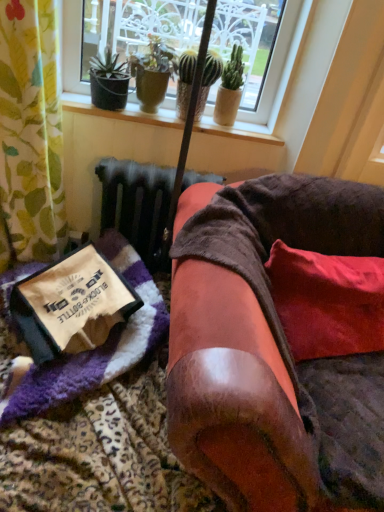
Describe the element at coordinates (185, 82) in the screenshot. This screenshot has height=512, width=384. I see `green textured cactus at upper center, which is the second houseplant in right-to-left order` at that location.

This screenshot has width=384, height=512. I want to click on red velvet pillow at lower right, so tap(327, 301).

This screenshot has height=512, width=384. What are the coordinates of `green matte cactus at upper center, which is the 1th houseplant from right to left` in the screenshot? It's located at (230, 89).

Describe the element at coordinates (121, 112) in the screenshot. I see `wooden at upper center` at that location.

Where is `green textured pot at upper center, the third houseplant in the right-to-left sequence`? The width and height of the screenshot is (384, 512). green textured pot at upper center, the third houseplant in the right-to-left sequence is located at coordinates (152, 73).

You are a GUI agent. You are given a task and a screenshot of the screen. Output one action in this format:
    pyautogui.click(x=<x>, y=<y>)
    Task: Click on the green textured cactus at upper center, which is the second houseplant in right-to-left order
    The height and width of the screenshot is (512, 384).
    Given the screenshot: What is the action you would take?
    pyautogui.click(x=185, y=82)

Is green textured pot at upper center, placed as the first houseplant when sorted from left to right, inside purple fuzzy blanket at lower left?

No, green textured pot at upper center, placed as the first houseplant when sorted from left to right, is not inside purple fuzzy blanket at lower left.

Is purple fuzzy blanket at lower left in front of or behind green textured pot at upper center, the third houseplant in the right-to-left sequence, in the image?

purple fuzzy blanket at lower left is in front of green textured pot at upper center, the third houseplant in the right-to-left sequence.

Are purple fuzzy blanket at lower left and green textured pot at upper center, placed as the first houseplant when sorted from left to right, making contact?

No, purple fuzzy blanket at lower left is not with green textured pot at upper center, placed as the first houseplant when sorted from left to right.

Consider the image. From a real-world perspective, is purple fuzzy blanket at lower left physically located above or below green textured pot at upper center, the third houseplant in the right-to-left sequence?

Clearly, from a real-world perspective, purple fuzzy blanket at lower left is below green textured pot at upper center, the third houseplant in the right-to-left sequence.

Considering the relative sizes of green textured pot at upper center, the third houseplant in the right-to-left sequence, and green matte cactus at upper center, which is the 1th houseplant from right to left, in the image provided, is green textured pot at upper center, the third houseplant in the right-to-left sequence, thinner than green matte cactus at upper center, which is the 1th houseplant from right to left,?

Incorrect, the width of green textured pot at upper center, the third houseplant in the right-to-left sequence, is not less than that of green matte cactus at upper center, which is the 1th houseplant from right to left.

Would you say green textured pot at upper center, placed as the first houseplant when sorted from left to right, is outside green matte cactus at upper center, which is the third houseplant from left to right?

Yes, green textured pot at upper center, placed as the first houseplant when sorted from left to right, is not within green matte cactus at upper center, which is the third houseplant from left to right.

Is green textured pot at upper center, the third houseplant in the right-to-left sequence, taller than green matte cactus at upper center, which is the third houseplant from left to right?

No, green textured pot at upper center, the third houseplant in the right-to-left sequence, is not taller than green matte cactus at upper center, which is the third houseplant from left to right.

From the image's perspective, is green textured pot at upper center, placed as the first houseplant when sorted from left to right, beneath green matte cactus at upper center, which is the 1th houseplant from right to left?

Actually, green textured pot at upper center, placed as the first houseplant when sorted from left to right, appears above green matte cactus at upper center, which is the 1th houseplant from right to left, in the image.

From the image's perspective, is purple fuzzy blanket at lower left located above or below wooden at upper center?

Clearly, from the image's perspective, purple fuzzy blanket at lower left is below wooden at upper center.

Is purple fuzzy blanket at lower left positioned before wooden at upper center?

Yes, purple fuzzy blanket at lower left is in front of wooden at upper center.

Is point (94, 381) more distant than point (140, 115)?

That is False.

Considering the relative sizes of purple fuzzy blanket at lower left and wooden at upper center in the image provided, is purple fuzzy blanket at lower left bigger than wooden at upper center?

Yes, purple fuzzy blanket at lower left is bigger than wooden at upper center.

Is green textured cactus at upper center, which is the second houseplant in right-to-left order, positioned in front of purple fuzzy blanket at lower left?

No, green textured cactus at upper center, which is the second houseplant in right-to-left order, is further to the viewer.

Considering the points (182, 76) and (61, 360), which point is behind, point (182, 76) or point (61, 360)?

Point (182, 76)

Can purple fuzzy blanket at lower left be found inside green textured cactus at upper center, the second houseplant in the left-to-right sequence?

Actually, purple fuzzy blanket at lower left is outside green textured cactus at upper center, the second houseplant in the left-to-right sequence.

Which object is wider, green textured cactus at upper center, which is the second houseplant in right-to-left order, or purple fuzzy blanket at lower left?

purple fuzzy blanket at lower left.

Are red velvet pillow at lower right and velvet brown armchair at center located far from each other?

red velvet pillow at lower right is near velvet brown armchair at center, not far away.

From a real-world perspective, is red velvet pillow at lower right beneath velvet brown armchair at center?

Incorrect, from a real-world perspective, red velvet pillow at lower right is higher than velvet brown armchair at center.

This screenshot has width=384, height=512. Identify the location of pillow behind the velvet brown armchair at center. (327, 301).

Visually, is green textured pot at upper center, placed as the first houseplant when sorted from left to right, positioned to the left or to the right of wooden at upper center?

Based on their positions, green textured pot at upper center, placed as the first houseplant when sorted from left to right, is located to the left of wooden at upper center.

From a real-world perspective, relative to wooden at upper center, is green textured pot at upper center, the third houseplant in the right-to-left sequence, vertically above or below?

green textured pot at upper center, the third houseplant in the right-to-left sequence, is situated higher than wooden at upper center in the real world.

Based on the photo, is green textured pot at upper center, the third houseplant in the right-to-left sequence, not within wooden at upper center?

Indeed, green textured pot at upper center, the third houseplant in the right-to-left sequence, is completely outside wooden at upper center.

Considering the sizes of objects red velvet pillow at lower right and green matte cactus at upper center, which is the 1th houseplant from right to left, in the image provided, who is thinner, red velvet pillow at lower right or green matte cactus at upper center, which is the 1th houseplant from right to left,?

green matte cactus at upper center, which is the 1th houseplant from right to left, is thinner.

Who is smaller, red velvet pillow at lower right or green matte cactus at upper center, which is the 1th houseplant from right to left?

With smaller size is green matte cactus at upper center, which is the 1th houseplant from right to left.

From a real-world perspective, is red velvet pillow at lower right located higher than green matte cactus at upper center, which is the 1th houseplant from right to left?

Incorrect, from a real-world perspective, red velvet pillow at lower right is lower than green matte cactus at upper center, which is the 1th houseplant from right to left.

This screenshot has height=512, width=384. I want to click on pillow on the right of green matte cactus at upper center, which is the third houseplant from left to right, so click(327, 301).

Find the location of a particular element. the 1st houseplant behind the purple fuzzy blanket at lower left is located at coordinates (152, 73).

Identify the location of the 2nd houseplant counting from the right of the green textured pot at upper center, the third houseplant in the right-to-left sequence. This screenshot has width=384, height=512. (230, 89).

Which object lies further to the anchor point green textured pot at upper center, the third houseplant in the right-to-left sequence, wooden at upper center or red velvet pillow at lower right?

red velvet pillow at lower right.

Which object lies nearer to the anchor point wooden at upper center, velvet brown armchair at center or green textured cactus at upper center, which is the second houseplant in right-to-left order?

green textured cactus at upper center, which is the second houseplant in right-to-left order, is positioned closer to the anchor wooden at upper center.

When comparing their distances from green textured pot at upper center, placed as the first houseplant when sorted from left to right, does red velvet pillow at lower right or green textured cactus at upper center, which is the second houseplant in right-to-left order, seem closer?

Among the two, green textured cactus at upper center, which is the second houseplant in right-to-left order, is located nearer to green textured pot at upper center, placed as the first houseplant when sorted from left to right.

Which object lies further to the anchor point wooden at upper center, purple fuzzy blanket at lower left or green textured pot at upper center, the third houseplant in the right-to-left sequence?

purple fuzzy blanket at lower left is further to wooden at upper center.

When comparing their distances from red velvet pillow at lower right, does green textured cactus at upper center, which is the second houseplant in right-to-left order, or green matte cactus at upper center, which is the 1th houseplant from right to left, seem closer?

green textured cactus at upper center, which is the second houseplant in right-to-left order, lies closer to red velvet pillow at lower right than the other object.

Based on their spatial positions, is wooden at upper center or green matte cactus at upper center, which is the 1th houseplant from right to left, closer to red velvet pillow at lower right?

Based on the image, wooden at upper center appears to be nearer to red velvet pillow at lower right.

Estimate the real-world distances between objects in this image. Which object is further from purple fuzzy blanket at lower left, green textured pot at upper center, placed as the first houseplant when sorted from left to right, or red velvet pillow at lower right?

green textured pot at upper center, placed as the first houseplant when sorted from left to right, lies further to purple fuzzy blanket at lower left than the other object.

Which object lies further to the anchor point green matte cactus at upper center, which is the 1th houseplant from right to left, green textured cactus at upper center, the second houseplant in the left-to-right sequence, or wooden at upper center?

wooden at upper center lies further to green matte cactus at upper center, which is the 1th houseplant from right to left, than the other object.

Find the location of a particular element. window sill situated between purple fuzzy blanket at lower left and red velvet pillow at lower right from left to right is located at coordinates (121, 112).

At what (x,y) coordinates should I click in order to perform the action: click on window sill between green matte cactus at upper center, which is the 1th houseplant from right to left, and red velvet pillow at lower right in the up-down direction. Please return your answer as a coordinate pair (x, y). Looking at the image, I should click on (121, 112).

Locate an element on the screen. window sill between green textured cactus at upper center, which is the second houseplant in right-to-left order, and velvet brown armchair at center from top to bottom is located at coordinates (121, 112).

You are a GUI agent. You are given a task and a screenshot of the screen. Output one action in this format:
    pyautogui.click(x=<x>, y=<y>)
    Task: Click on the blanket that lies between green textured cactus at upper center, the second houseplant in the left-to-right sequence, and velvet brown armchair at center from top to bottom
    The height and width of the screenshot is (512, 384).
    Given the screenshot: What is the action you would take?
    pyautogui.click(x=97, y=347)